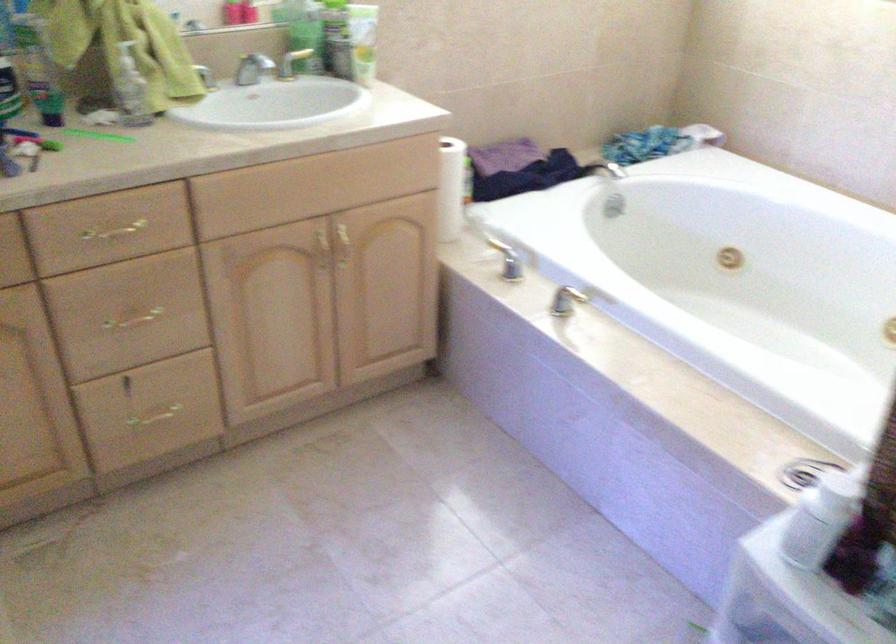
This screenshot has height=644, width=896. Find the location of `paper towel roll`. paper towel roll is located at coordinates (451, 187).